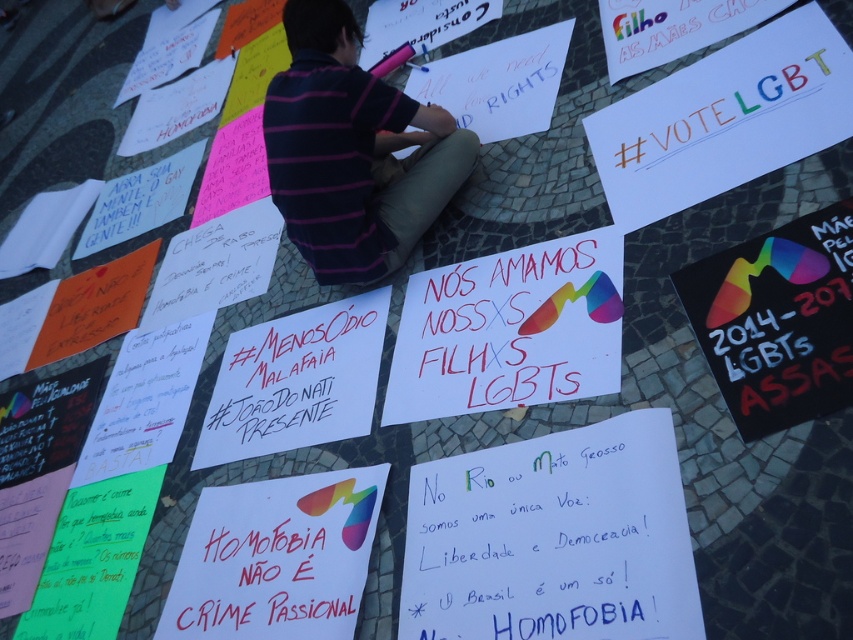
Which of these two, striped cotton shirt at center or matte white sign at center, stands shorter?

matte white sign at center

Is striped cotton shirt at center below matte white sign at center?

No.

Which is in front, point (312, 164) or point (227, 515)?

Positioned in front is point (312, 164).

Locate an element on the screen. striped cotton shirt at center is located at coordinates (352, 150).